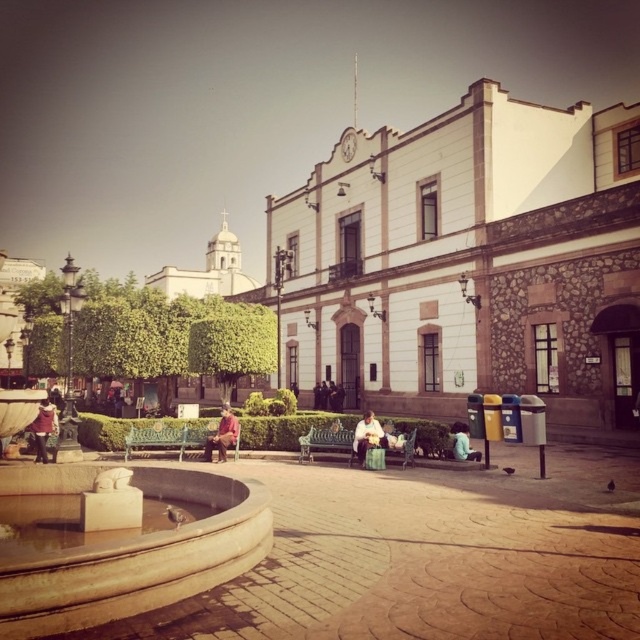
Does light brown fabric bag at center have a lesser width compared to matte red shirt at lower left?

Correct, light brown fabric bag at center's width is less than matte red shirt at lower left's.

Does light brown fabric bag at center have a lesser height compared to matte red shirt at lower left?

Indeed, light brown fabric bag at center has a lesser height compared to matte red shirt at lower left.

Does point (362, 442) lie behind point (42, 435)?

No, (362, 442) is in front of (42, 435).

Image resolution: width=640 pixels, height=640 pixels. In order to click on light brown fabric bag at center in this screenshot , I will do click(x=368, y=436).

Does reddish-brown fabric jacket at center have a larger size compared to light blue shirt at center?

Yes.

Can you confirm if reddish-brown fabric jacket at center is thinner than light blue shirt at center?

In fact, reddish-brown fabric jacket at center might be wider than light blue shirt at center.

The image size is (640, 640). What do you see at coordinates (221, 435) in the screenshot?
I see `reddish-brown fabric jacket at center` at bounding box center [221, 435].

Locate an element on the screen. This screenshot has height=640, width=640. reddish-brown fabric jacket at center is located at coordinates (221, 435).

Is reddish-brown fabric jacket at center taller than matte red shirt at lower left?

No, reddish-brown fabric jacket at center is not taller than matte red shirt at lower left.

Does reddish-brown fabric jacket at center appear on the right side of matte red shirt at lower left?

Yes, reddish-brown fabric jacket at center is to the right of matte red shirt at lower left.

What do you see at coordinates (221, 435) in the screenshot? I see `reddish-brown fabric jacket at center` at bounding box center [221, 435].

Find the location of a particular element. The height and width of the screenshot is (640, 640). reddish-brown fabric jacket at center is located at coordinates (221, 435).